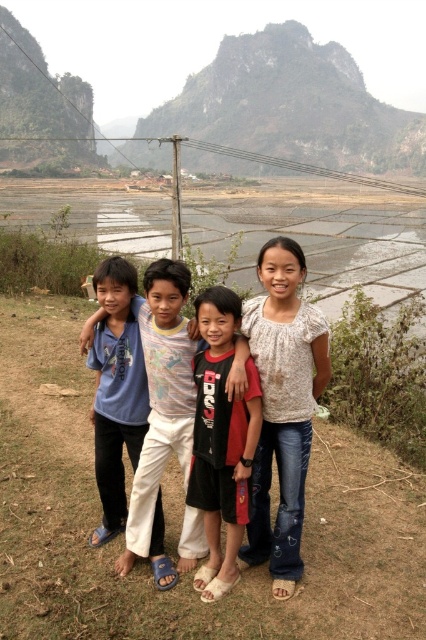
Does black cotton t-shirt at center have a larger size compared to light blue t-shirt at center?

Incorrect, black cotton t-shirt at center is not larger than light blue t-shirt at center.

The image size is (426, 640). What are the coordinates of `black cotton t-shirt at center` in the screenshot? It's located at (221, 440).

Between black cotton t-shirt at center and blue cotton shirt at center, which one is positioned lower?

black cotton t-shirt at center

The image size is (426, 640). In order to click on black cotton t-shirt at center in this screenshot , I will do `click(221, 440)`.

This screenshot has width=426, height=640. I want to click on black cotton t-shirt at center, so click(x=221, y=440).

Who is more distant from viewer, (279, 573) or (213, 493)?

The point (279, 573) is behind.

Between white textured blouse at center and black cotton t-shirt at center, which one has more height?

black cotton t-shirt at center

You are a GUI agent. You are given a task and a screenshot of the screen. Output one action in this format:
    pyautogui.click(x=<x>, y=<y>)
    Task: Click on the white textured blouse at center
    
    Given the screenshot: What is the action you would take?
    pyautogui.click(x=282, y=404)

Identify the location of white textured blouse at center. (282, 404).